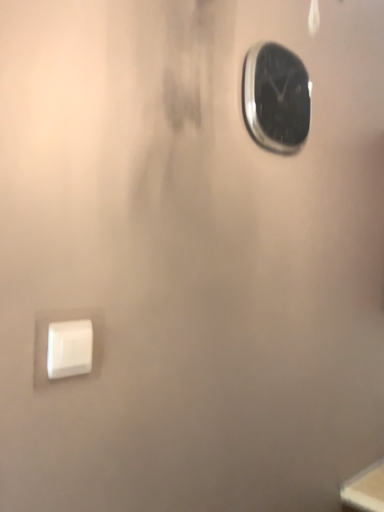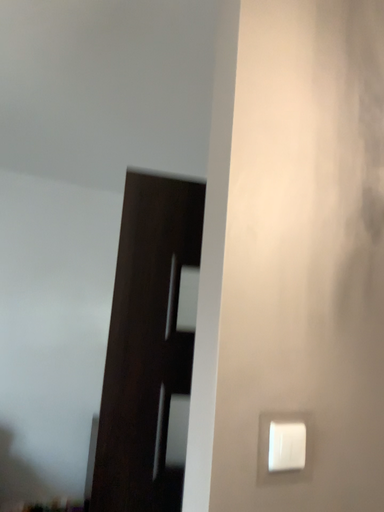
Question: How did the camera likely rotate when shooting the video?

Choices:
 (A) rotated downward
 (B) rotated upward

Answer: (B)